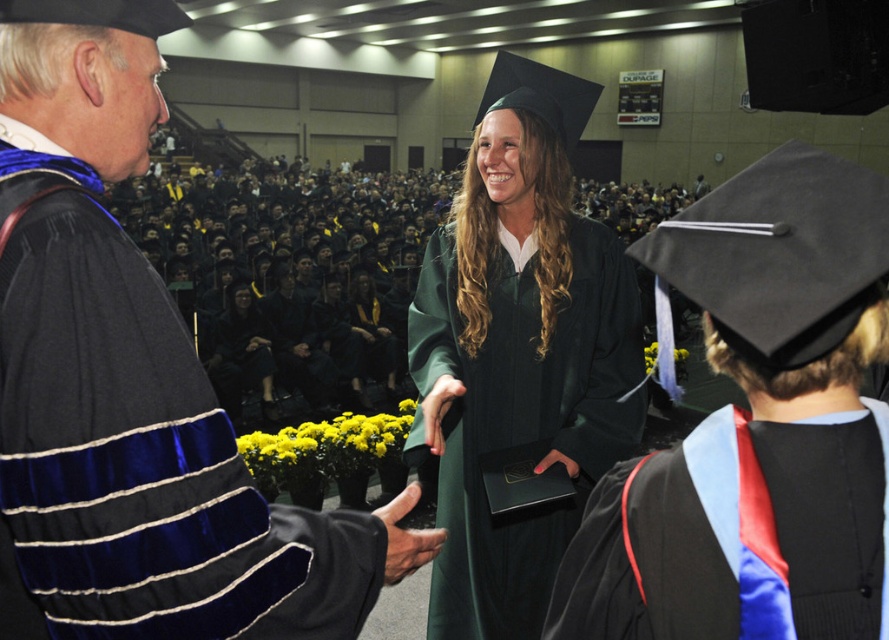
Who is shorter, green matte graduation gown at center or black satin sash at center?

black satin sash at center is shorter.

Which is in front, point (461, 296) or point (653, 516)?

Positioned in front is point (653, 516).

At what (x,y) coordinates should I click in order to perform the action: click on green matte graduation gown at center. Please return your answer as a coordinate pair (x, y). The height and width of the screenshot is (640, 889). Looking at the image, I should click on (519, 352).

Does velvety black gown at left have a lesser height compared to black satin sash at center?

In fact, velvety black gown at left may be taller than black satin sash at center.

Find the location of a particular element. Image resolution: width=889 pixels, height=640 pixels. velvety black gown at left is located at coordinates (126, 381).

Does green matte graduation gown at center have a lesser height compared to smooth black glove at center?

No.

Who is positioned more to the right, green matte graduation gown at center or smooth black glove at center?

green matte graduation gown at center is more to the right.

Is point (446, 323) farther from viewer compared to point (393, 541)?

That is True.

Find the location of `green matte graduation gown at center`. green matte graduation gown at center is located at coordinates (519, 352).